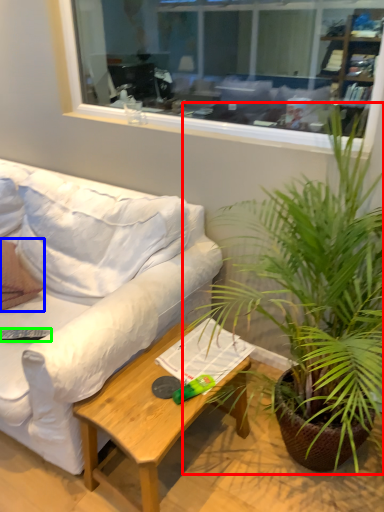
Question: Considering the real-world distances, which object is farthest from houseplant (highlighted by a red box)? pillow (highlighted by a blue box) or remote control (highlighted by a green box)?

Choices:
 (A) pillow
 (B) remote control

Answer: (A)